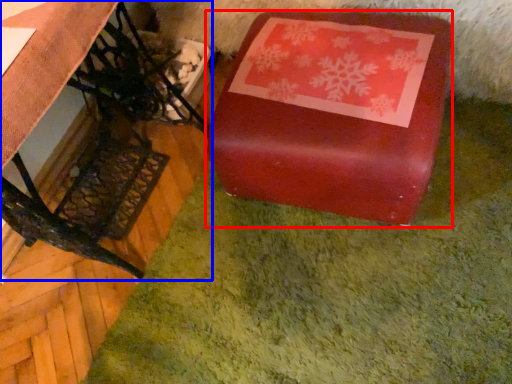
Question: Among these objects, which one is farthest to the camera, table (highlighted by a red box) or furniture (highlighted by a blue box)?

Choices:
 (A) table
 (B) furniture

Answer: (A)